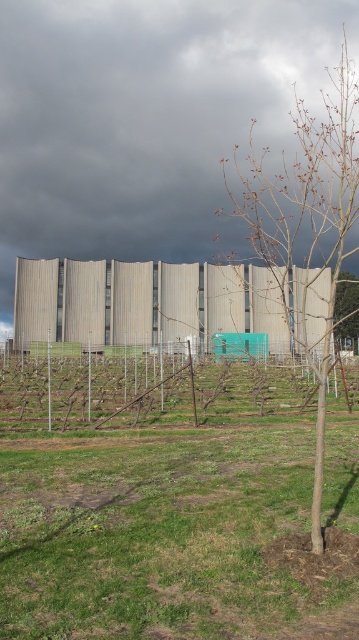
Question: Which point is farther to the camera?

Choices:
 (A) dark gray cloud at upper center
 (B) bare branches at right
 (C) green grass at center

Answer: (A)

Question: Is beige corrugated metal building at center behind bare wood tree at right?

Choices:
 (A) yes
 (B) no

Answer: (A)

Question: Is green grass at center to the right of bare branches at right from the viewer's perspective?

Choices:
 (A) no
 (B) yes

Answer: (A)

Question: Which of the following is the farthest from the observer?

Choices:
 (A) green grass at center
 (B) beige corrugated metal building at center

Answer: (B)

Question: Is dark gray cloud at upper center bigger than beige corrugated metal building at center?

Choices:
 (A) no
 (B) yes

Answer: (B)

Question: Which object is the closest to the bare wood tree at right?

Choices:
 (A) beige corrugated metal building at center
 (B) green grass at center
 (C) bare branches at right

Answer: (C)